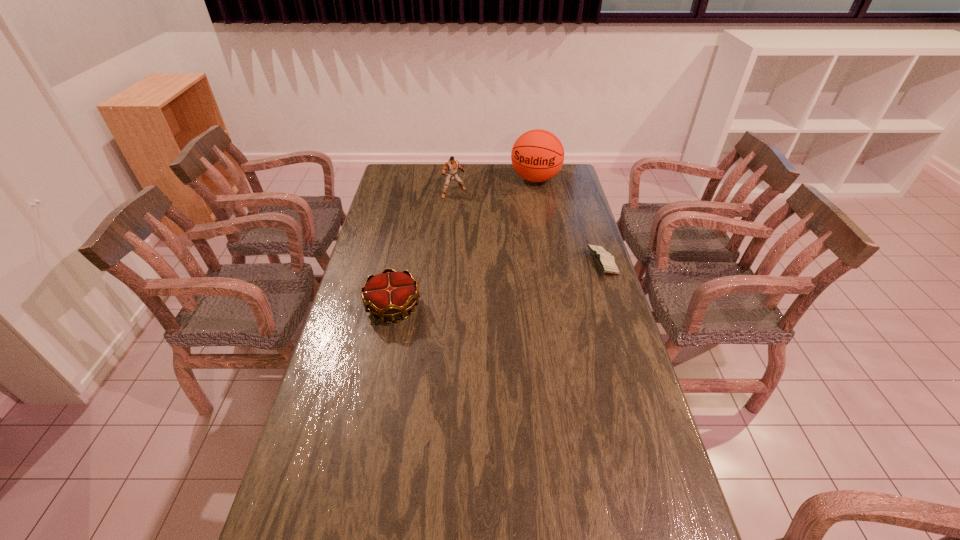
Locate an element on the screen. basketball positioned at the right edge is located at coordinates (537, 155).

What are the coordinates of `object positioned at the far right corner` in the screenshot? It's located at (537, 155).

The image size is (960, 540). I want to click on vacant space at the far edge of the desktop, so click(x=479, y=170).

In the image, there is a desktop. Where is `vacant space at the near edge`? This screenshot has height=540, width=960. vacant space at the near edge is located at coordinates (587, 515).

In order to click on vacant space at the right edge in this screenshot , I will do `click(608, 277)`.

Locate an element on the screen. The height and width of the screenshot is (540, 960). free space at the far right corner is located at coordinates (548, 181).

Image resolution: width=960 pixels, height=540 pixels. I want to click on vacant point located between the second object from left to right and the shortest object, so click(528, 227).

Identify the location of empty space that is in between the second shortest object and the basketball. (465, 243).

Find the location of a particular element. The height and width of the screenshot is (540, 960). vacant area between the second tallest object and the basketball is located at coordinates (494, 186).

Where is `vacant area between the puncher and the diary`? vacant area between the puncher and the diary is located at coordinates (528, 227).